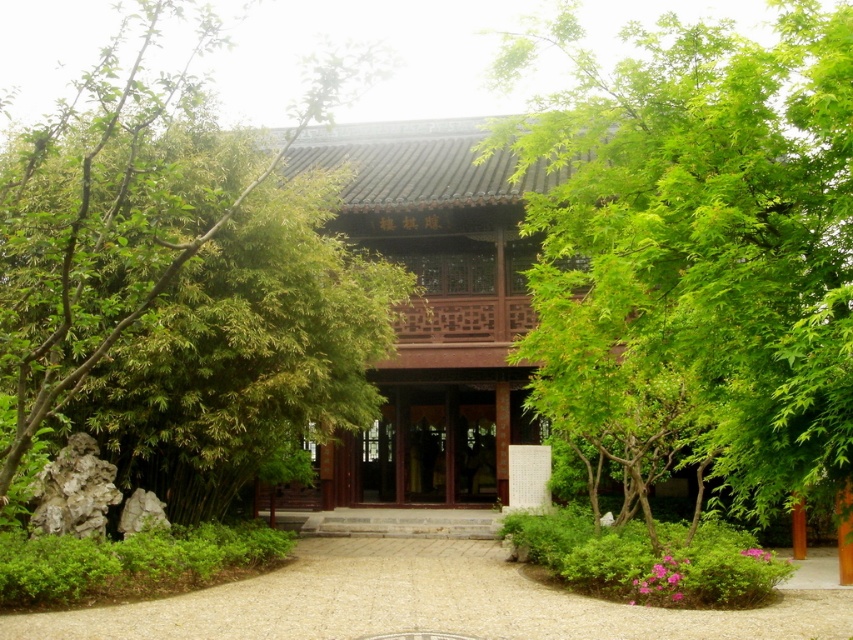
You are a gardener planning to plant a new tree in the garden. You observe the green bamboo at left and the smooth gravel path at center. Which object is narrower in width?

The green bamboo at left is thinner than the smooth gravel path at center, so the green bamboo at left is narrower in width.

From the picture: You are a visitor standing at the entrance of the pavilion. You notice the green bamboo at left and the smooth gravel path at center. Which object is taller?

The green bamboo at left is taller than the smooth gravel path at center.